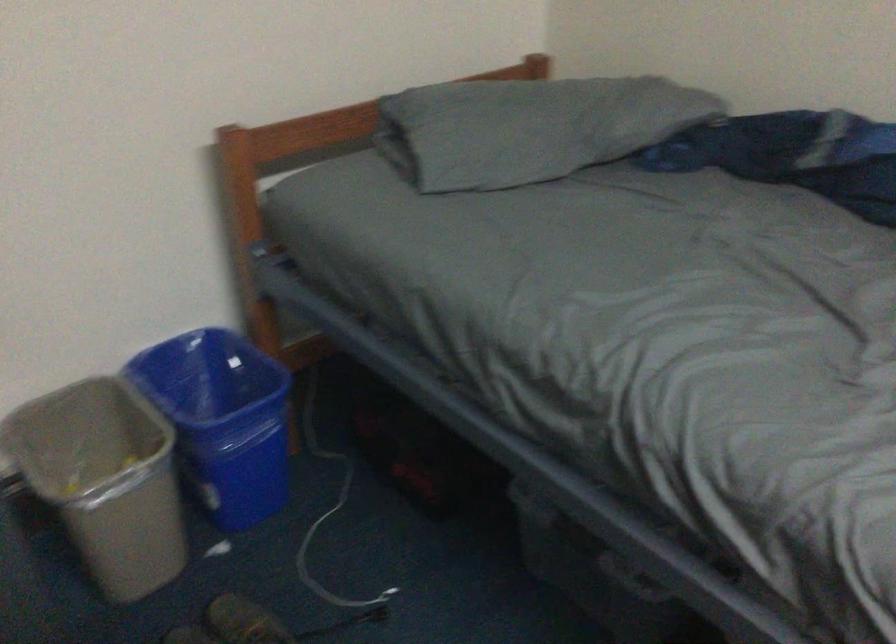
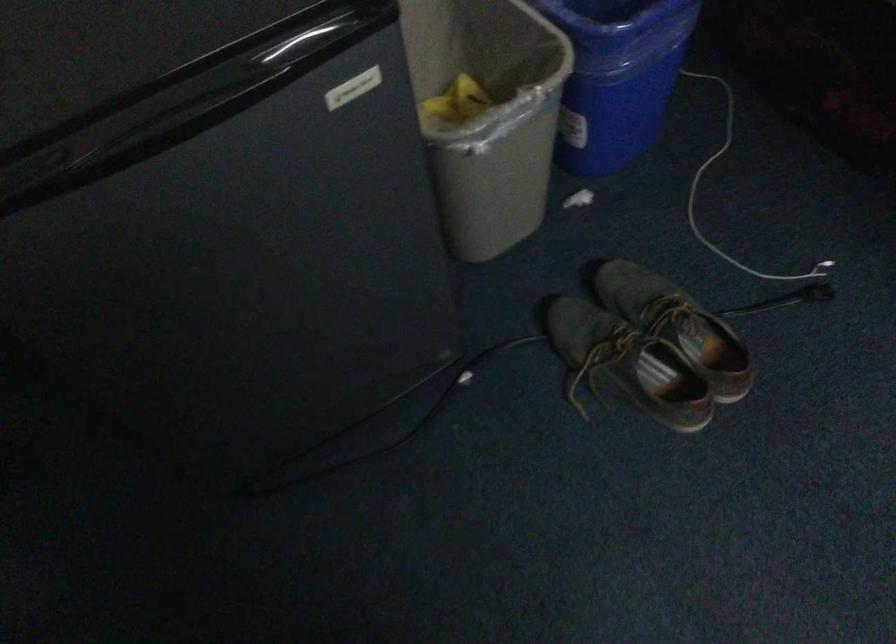
Which direction would the cameraman need to move to produce the second image?

The cameraman moved toward left, forward.